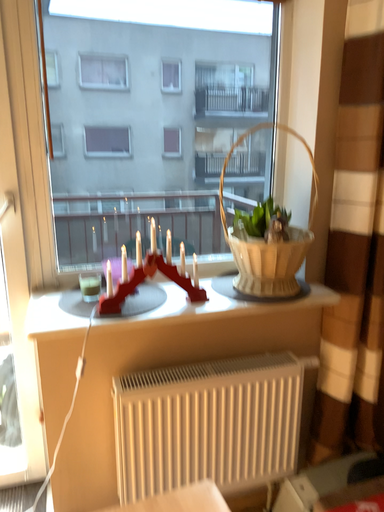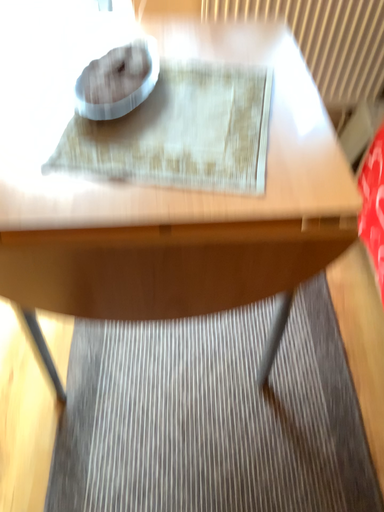
Question: Which way did the camera rotate in the video?

Choices:
 (A) rotated right
 (B) rotated left

Answer: (B)